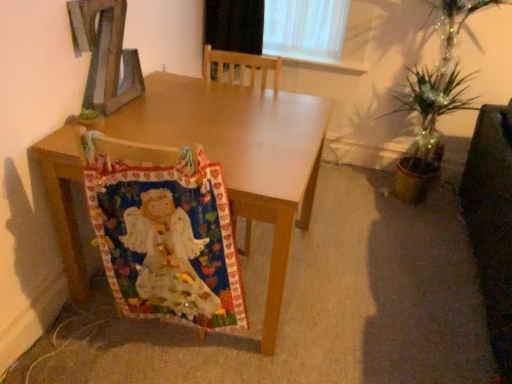
The width and height of the screenshot is (512, 384). Identify the location of vacant region in front of wooden letter z at upper left. (116, 119).